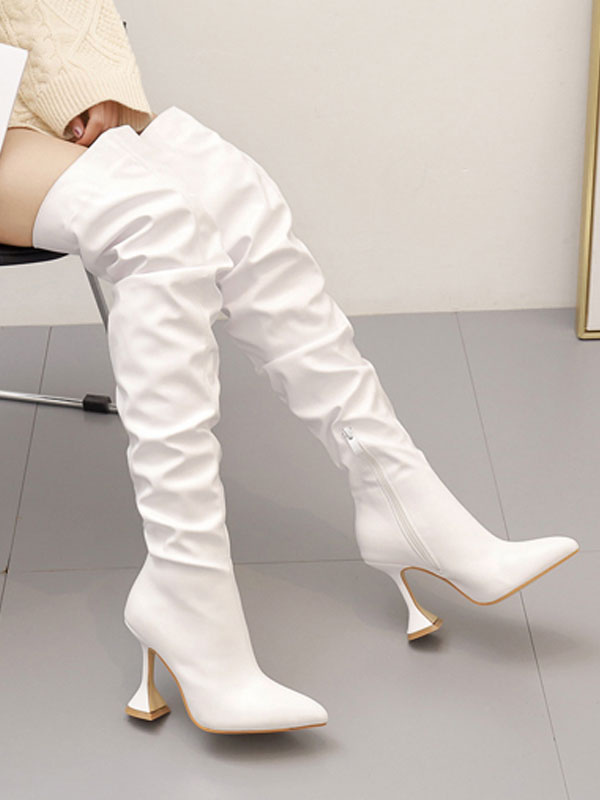
This screenshot has height=800, width=600. Find the location of `lines in floor`. lines in floor is located at coordinates (467, 350), (14, 530), (287, 561), (538, 650).